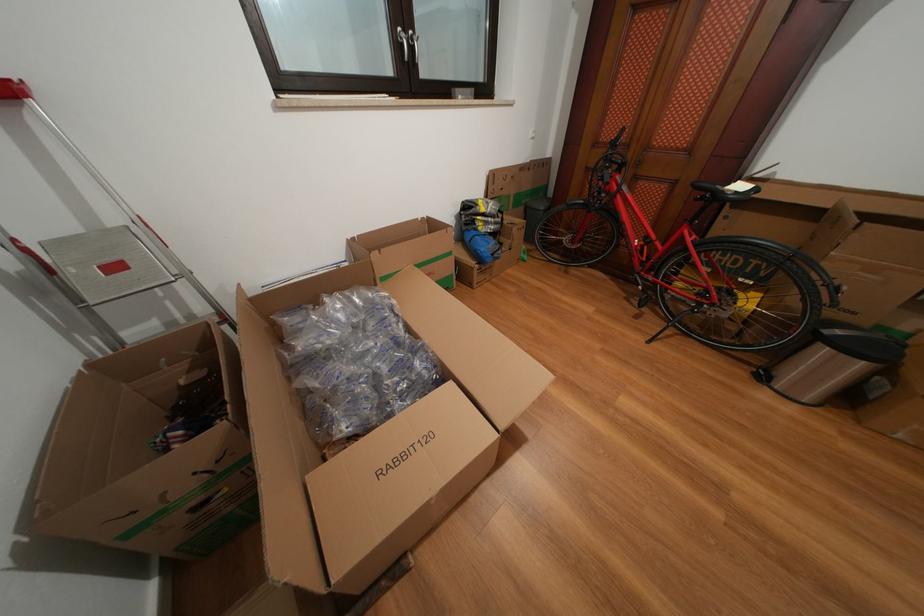
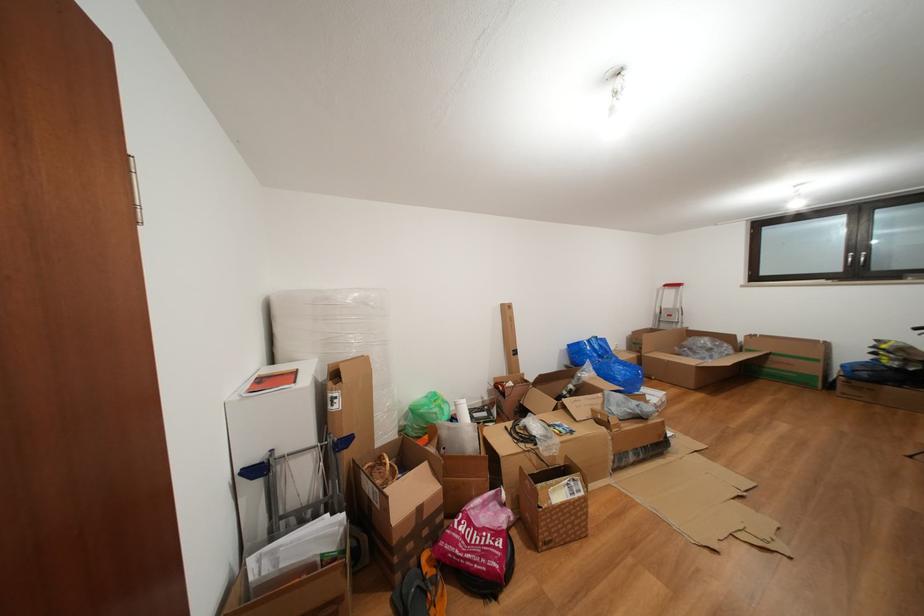
Locate, in the second image, the point that corresponds to the point at 458,259 in the first image.

(824, 366)